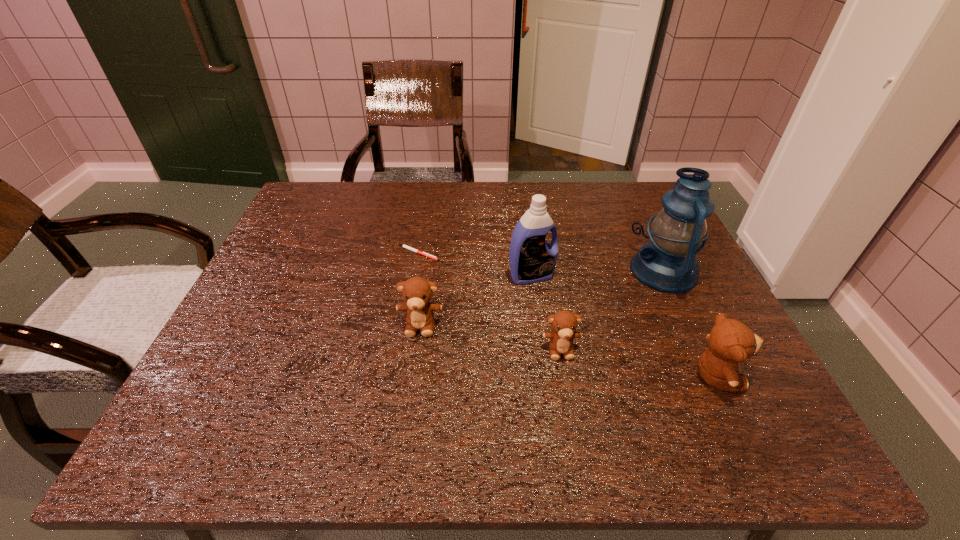
What are the coordinates of `the third shortest object` in the screenshot? It's located at (416, 291).

The width and height of the screenshot is (960, 540). I want to click on the leftmost teddy bear, so pyautogui.click(x=416, y=291).

Locate an element on the screen. The image size is (960, 540). the second teddy bear from left to right is located at coordinates (564, 323).

Where is `the shortest teddy bear`? The image size is (960, 540). the shortest teddy bear is located at coordinates [564, 323].

Identify the location of the rightmost teddy bear. (730, 341).

Image resolution: width=960 pixels, height=540 pixels. What are the coordinates of `the tallest teddy bear` in the screenshot? It's located at (730, 341).

I want to click on lantern, so click(668, 263).

The height and width of the screenshot is (540, 960). Find the location of `the shortest object`. the shortest object is located at coordinates (405, 246).

At what (x,y) coordinates should I click in order to perform the action: click on detergent. Please return your answer as a coordinate pair (x, y). This screenshot has height=540, width=960. Looking at the image, I should click on (532, 259).

Find the location of a particular element. This screenshot has width=960, height=540. vacant space located on the face of the leftmost teddy bear is located at coordinates (412, 389).